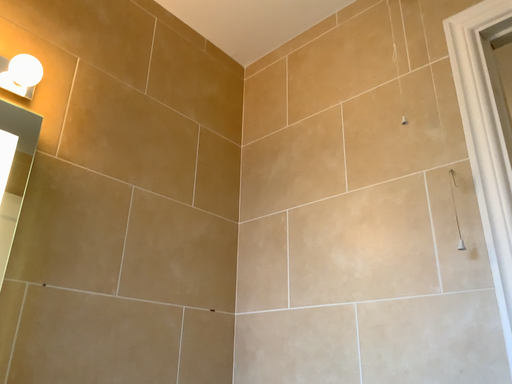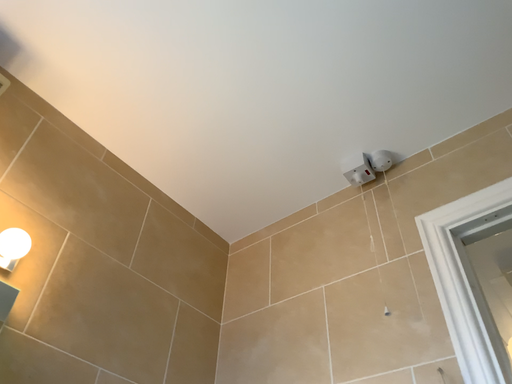
Question: Which way did the camera rotate in the video?

Choices:
 (A) rotated downward
 (B) rotated upward

Answer: (B)